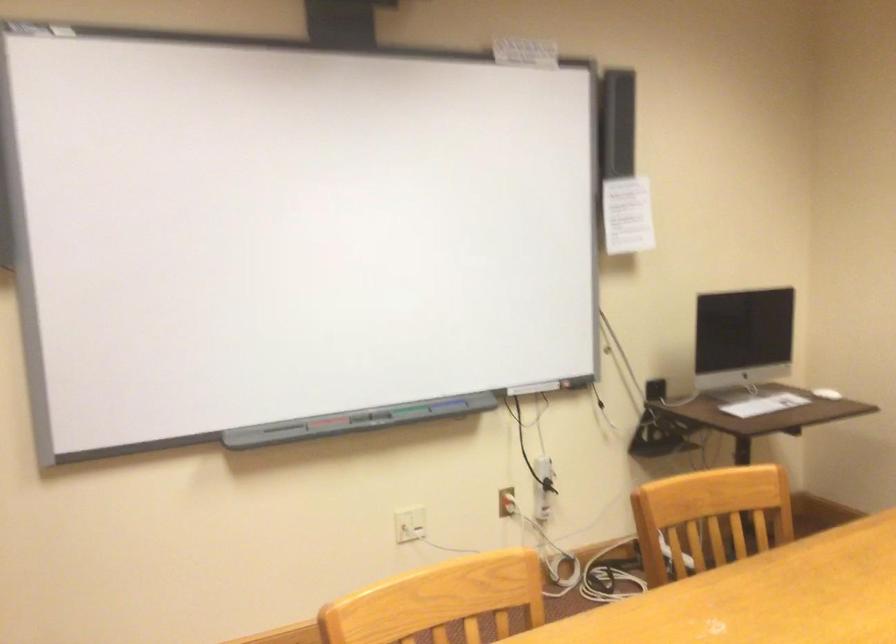
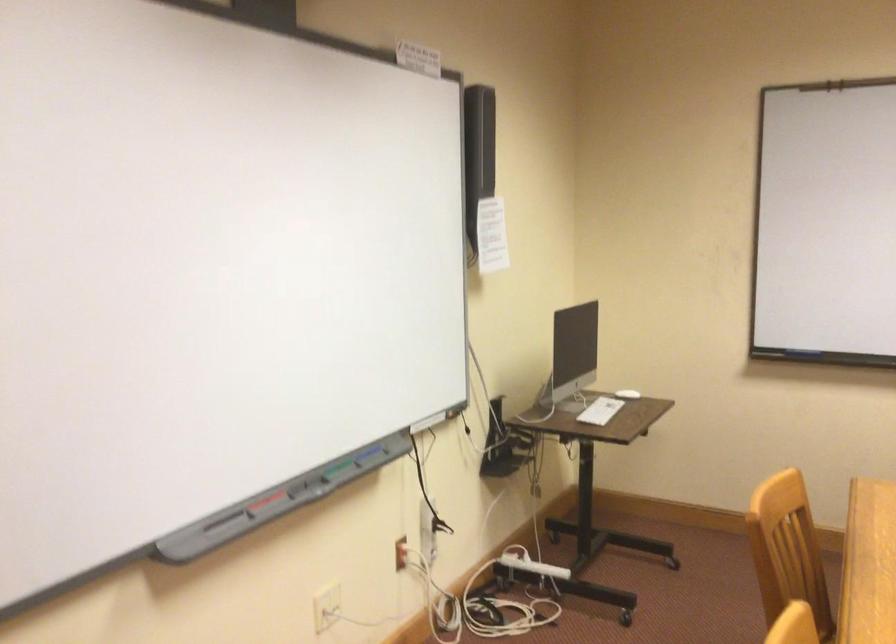
The point at (815, 393) is marked in the first image. Where is the corresponding point in the second image?

(627, 393)